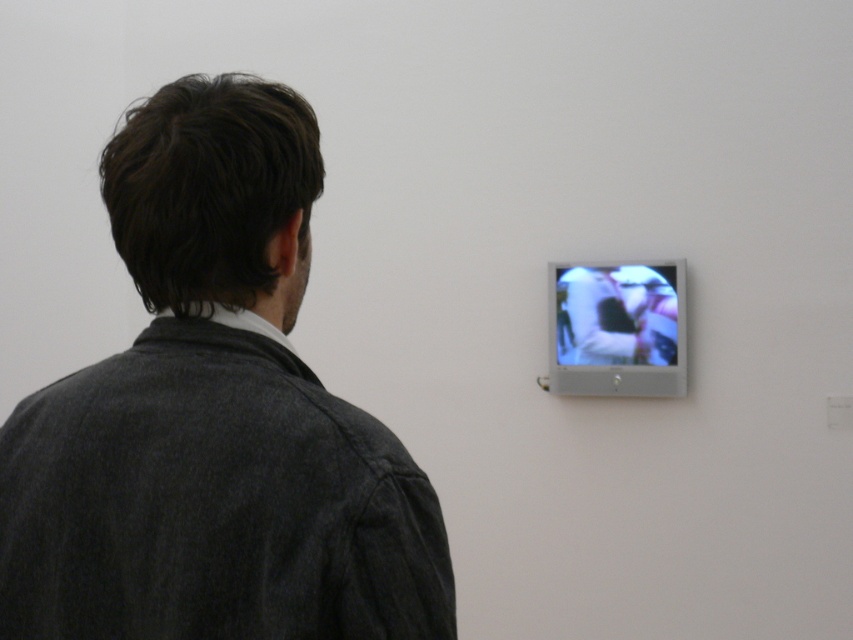
Who is positioned more to the right, dark gray woolen jacket at center or matte silver screen at upper right?

From the viewer's perspective, matte silver screen at upper right appears more on the right side.

Is dark gray woolen jacket at center closer to camera compared to matte silver screen at upper right?

Yes, it is in front of matte silver screen at upper right.

Find the location of `dark gray woolen jacket at center`. dark gray woolen jacket at center is located at coordinates (213, 417).